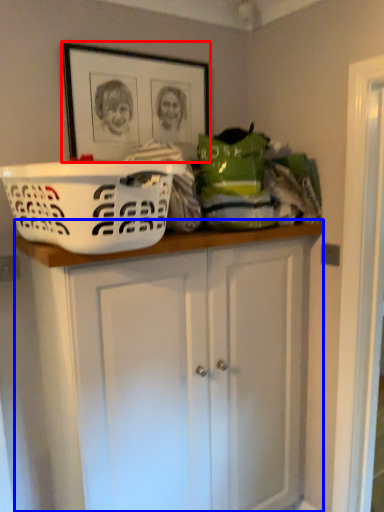
Question: Which of the following is the closest to the observer, picture frame (highlighted by a red box) or cabinetry (highlighted by a blue box)?

Choices:
 (A) picture frame
 (B) cabinetry

Answer: (B)